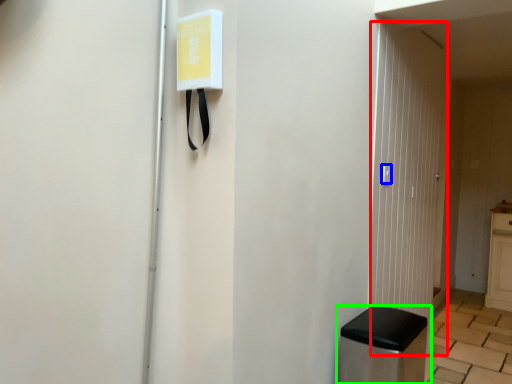
Question: Based on their relative distances, which object is nearer to glass door (highlighted by a red box)? Choose from light switch (highlighted by a blue box) and furniture (highlighted by a green box).

Choices:
 (A) light switch
 (B) furniture

Answer: (A)